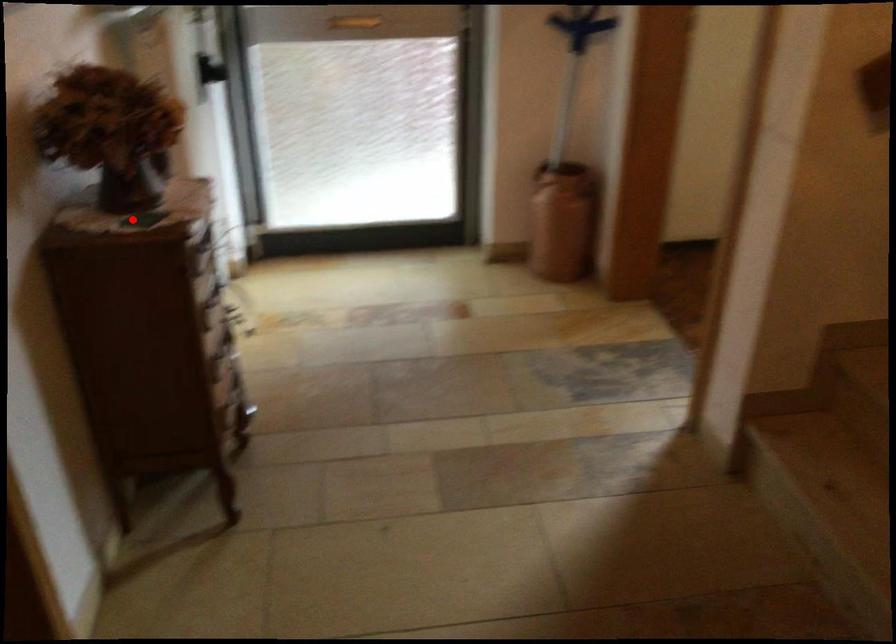
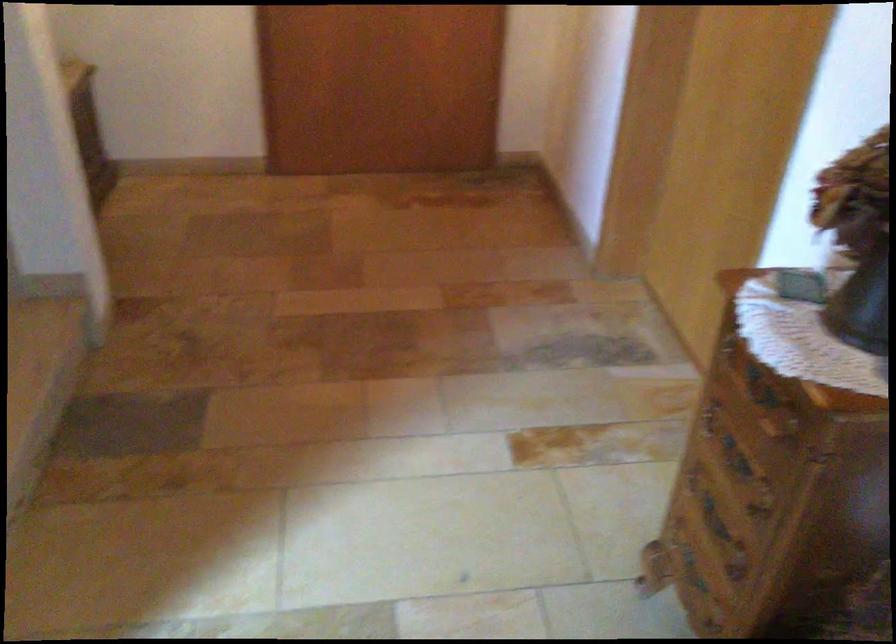
Where in the second image is the point corresponding to the highlighted location from the first image?

(863, 303)